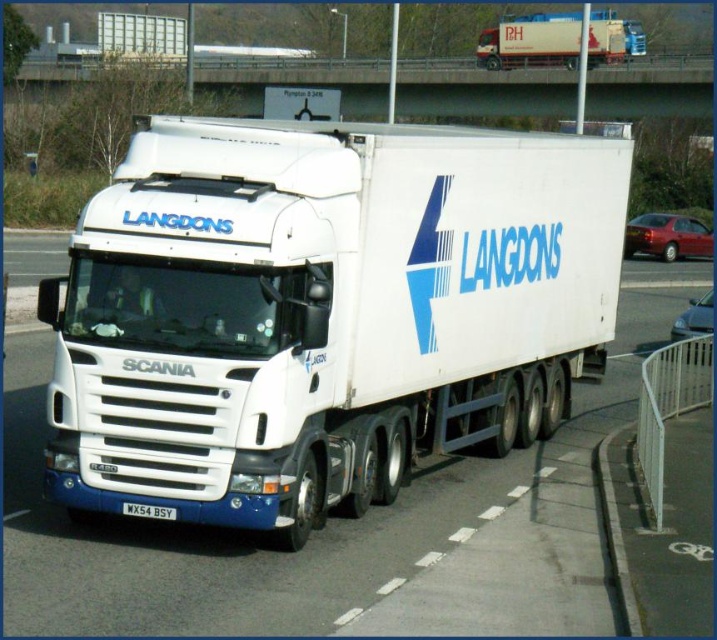
You are a driver who needs to read the license plate of the black plastic license plate at center. Is the white matte trailer truck at center blocking your view of the license plate?

The white matte trailer truck at center is in front of the black plastic license plate at center, so it is blocking the view of the license plate.

You are a truck driver planning to pass under the brushed metal bridge at upper center with your white matte trailer truck at center. Based on the scene, can you safely drive your truck under the bridge without any height restrictions?

The white matte trailer truck at center is positioned under the brushed metal bridge at upper center, which means there is enough clearance for the truck to pass safely under the bridge without any height restrictions.